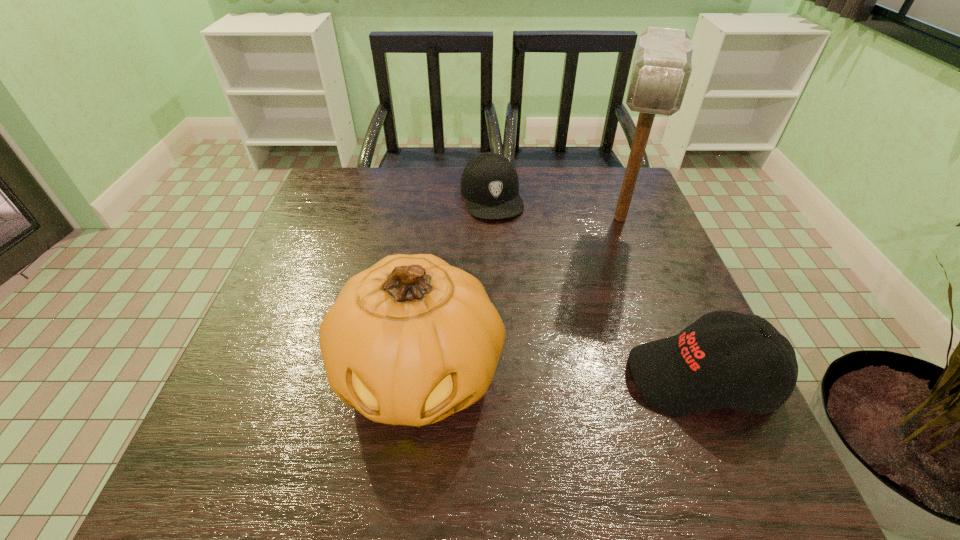
You are a GUI agent. You are given a task and a screenshot of the screen. Output one action in this format:
    pyautogui.click(x=<x>, y=<y>)
    Task: Click on the third shortest object
    
    Given the screenshot: What is the action you would take?
    pyautogui.click(x=411, y=340)

The width and height of the screenshot is (960, 540). In order to click on baseball cap in this screenshot , I will do `click(688, 373)`.

Identify the location of the tallest object. This screenshot has width=960, height=540. (662, 68).

The height and width of the screenshot is (540, 960). In order to click on cap in this screenshot , I will do `click(489, 183)`.

Where is `free location located 0.160m on the front-facing side of the third tallest object`? free location located 0.160m on the front-facing side of the third tallest object is located at coordinates (542, 378).

This screenshot has height=540, width=960. In order to click on free space located 0.330m on the front-facing side of the third tallest object in this screenshot , I will do [452, 378].

The height and width of the screenshot is (540, 960). I want to click on vacant space located 0.210m on the front-facing side of the third tallest object, so click(x=516, y=378).

Locate an element on the screen. The width and height of the screenshot is (960, 540). free space located 0.070m on the striking face of the mallet is located at coordinates (618, 264).

At what (x,y) coordinates should I click in order to perform the action: click on vacant area situated on the striking face of the mallet. Please return your answer as a coordinate pair (x, y). The image size is (960, 540). Looking at the image, I should click on (608, 335).

What are the coordinates of `free spot located on the striking face of the mallet` in the screenshot? It's located at point(618,258).